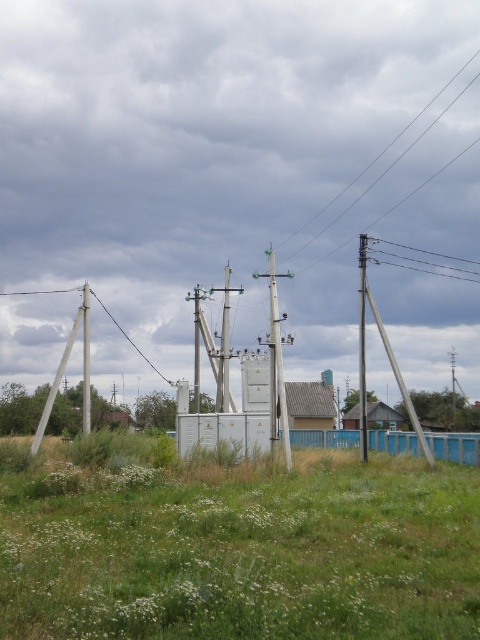
Who is positioned more to the left, metallic wire at upper right or white plastic telegraph pole at center?

white plastic telegraph pole at center is more to the left.

Between metallic wire at upper right and white plastic telegraph pole at center, which one appears on the right side from the viewer's perspective?

Positioned to the right is metallic wire at upper right.

You are a GUI agent. You are given a task and a screenshot of the screen. Output one action in this format:
    pyautogui.click(x=<x>, y=<y>)
    Task: Click on the metallic wire at upper right
    The image size is (480, 640).
    Given the screenshot: What is the action you would take?
    pyautogui.click(x=422, y=260)

Which is above, green grass at center or smooth wooden telegraph pole at right?

smooth wooden telegraph pole at right

Looking at this image, how much distance is there between green grass at center and smooth wooden telegraph pole at right?

A distance of 44.27 feet exists between green grass at center and smooth wooden telegraph pole at right.

Does point (427, 588) lie in front of point (395, 376)?

That is True.

Locate an element on the screen. This screenshot has width=480, height=640. green grass at center is located at coordinates (241, 552).

In the scene shown: Between green grass at center and green metallic pole at center, which one is positioned higher?

green metallic pole at center is above.

Does green grass at center appear on the left side of green metallic pole at center?

Indeed, green grass at center is positioned on the left side of green metallic pole at center.

Which is in front, point (427, 531) or point (274, 324)?

Point (427, 531)

Locate an element on the screen. green grass at center is located at coordinates (241, 552).